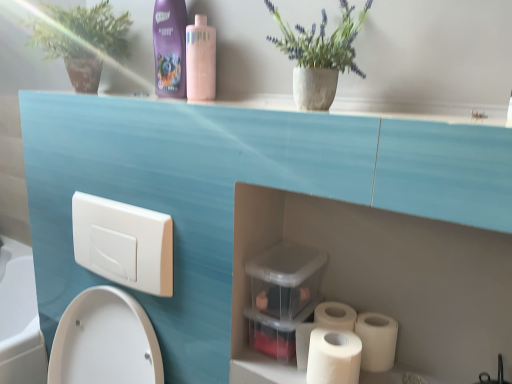
Question: From their relative heights in the image, would you say matte concrete pot at upper center is taller or shorter than white matte toilet paper at lower right, the first toilet paper when ordered from left to right?

Choices:
 (A) tall
 (B) short

Answer: (A)

Question: Is point (294, 46) positioned closer to the camera than point (342, 339)?

Choices:
 (A) farther
 (B) closer

Answer: (B)

Question: Which object is the closest to the white matte toilet paper at lower right, the first toilet paper when ordered from left to right?

Choices:
 (A) pink matte bottle at upper center, arranged as the 1th cleaning product when viewed from the right
 (B) white matte toilet paper at lower right, marked as the second toilet paper in a left-to-right arrangement
 (C) green matte plant at upper left
 (D) purple glossy shampoo at upper center, which is the second cleaning product from right to left
 (E) matte concrete pot at upper center

Answer: (B)

Question: Which is nearer to the purple glossy shampoo at upper center, the 1th cleaning product positioned from the left?

Choices:
 (A) matte concrete pot at upper center
 (B) pink matte bottle at upper center, which is the second cleaning product from left to right
 (C) white matte toilet paper at lower right, the second toilet paper positioned from the right
 (D) green matte plant at upper left
 (E) white matte toilet paper at lower right, which appears as the 1th toilet paper when viewed from the right

Answer: (B)